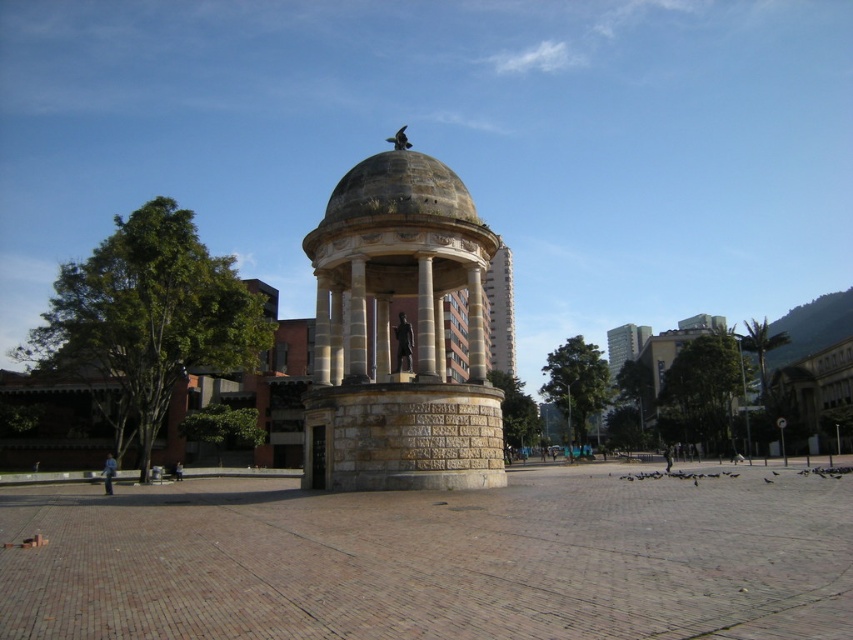
You are an architect analyzing the public square. You need to determine which of the two central structures, the stone gazebo at center or the smooth concrete tower at center, requires more interior space for maintenance. Based on their sizes, which one would need more space?

The smooth concrete tower at center is larger than the stone gazebo at center, so it would require more interior space for maintenance.

You are standing in the public square and want to take a closer look at both the stone gazebo at center and the smooth concrete tower at center. Which one should you approach first to get the best view of both structures?

You should approach the stone gazebo at center first since it is closer to you. After examining it, you can move further to see the smooth concrete tower at center which is behind it.

You are an architect analyzing the public square. Based on the scene, which structure at the center is shorter? The stone gazebo at center or the smooth concrete tower at center?

The stone gazebo at center is shorter than the smooth concrete tower at center according to the description.